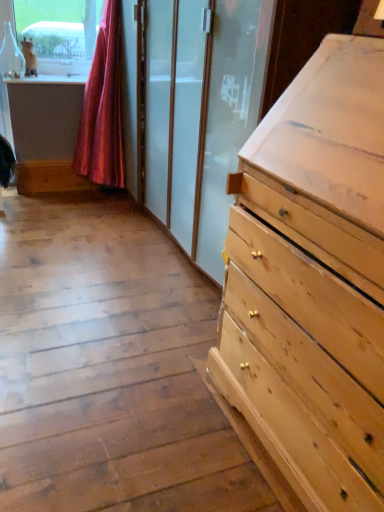
This screenshot has height=512, width=384. Describe the element at coordinates (103, 108) in the screenshot. I see `silky pink curtain at upper left` at that location.

You are a GUI agent. You are given a task and a screenshot of the screen. Output one action in this format:
    pyautogui.click(x=<x>, y=<y>)
    Task: Click on the silky pink curtain at upper left
    This screenshot has height=512, width=384.
    Given the screenshot: What is the action you would take?
    pyautogui.click(x=103, y=108)

The image size is (384, 512). What are the coordinates of `white fur cat at upper left` in the screenshot? It's located at (29, 57).

This screenshot has height=512, width=384. What do you see at coordinates (29, 57) in the screenshot?
I see `white fur cat at upper left` at bounding box center [29, 57].

At what (x,y) coordinates should I click in order to perform the action: click on silky pink curtain at upper left. Please return your answer as a coordinate pair (x, y). Looking at the image, I should click on (103, 108).

Considering the relative positions of silky pink curtain at upper left and white fur cat at upper left in the image provided, is silky pink curtain at upper left to the left of white fur cat at upper left from the viewer's perspective?

In fact, silky pink curtain at upper left is to the right of white fur cat at upper left.

Between silky pink curtain at upper left and white fur cat at upper left, which one is positioned in front?

silky pink curtain at upper left.

Is point (85, 127) positioned behind point (23, 42)?

Yes, point (85, 127) is behind point (23, 42).

From the image's perspective, is silky pink curtain at upper left located beneath white fur cat at upper left?

Indeed, from the image's perspective, silky pink curtain at upper left is shown beneath white fur cat at upper left.

From a real-world perspective, which object stands above the other?

From a 3D spatial view, white fur cat at upper left is above.

Considering the sizes of objects silky pink curtain at upper left and white fur cat at upper left in the image provided, who is wider, silky pink curtain at upper left or white fur cat at upper left?

With larger width is silky pink curtain at upper left.

Who is shorter, silky pink curtain at upper left or white fur cat at upper left?

Standing shorter between the two is white fur cat at upper left.

In terms of size, does silky pink curtain at upper left appear bigger or smaller than white fur cat at upper left?

Considering their sizes, silky pink curtain at upper left takes up more space than white fur cat at upper left.

Can white fur cat at upper left be found inside silky pink curtain at upper left?

Actually, white fur cat at upper left is outside silky pink curtain at upper left.

Is silky pink curtain at upper left positioned far away from white fur cat at upper left?

That's not correct — silky pink curtain at upper left is a little close to white fur cat at upper left.

From the picture: Is silky pink curtain at upper left oriented towards white fur cat at upper left?

No.

How distant is silky pink curtain at upper left from white fur cat at upper left?

silky pink curtain at upper left is 22.53 inches from white fur cat at upper left.

Identify the location of animal located above the silky pink curtain at upper left (from the image's perspective). This screenshot has height=512, width=384. (29, 57).

Is white fur cat at upper left at the left side of silky pink curtain at upper left?

Indeed, white fur cat at upper left is positioned on the left side of silky pink curtain at upper left.

Which object is closer to the camera, white fur cat at upper left or silky pink curtain at upper left?

silky pink curtain at upper left is more forward.

Considering the points (34, 66) and (101, 109), which point is behind, point (34, 66) or point (101, 109)?

The point (34, 66) is farther.

From the image's perspective, which is below, white fur cat at upper left or silky pink curtain at upper left?

silky pink curtain at upper left.

From a real-world perspective, is white fur cat at upper left physically above silky pink curtain at upper left?

Indeed, from a real-world perspective, white fur cat at upper left stands above silky pink curtain at upper left.

Which object is wider, white fur cat at upper left or silky pink curtain at upper left?

silky pink curtain at upper left.

Can you confirm if white fur cat at upper left is taller than silky pink curtain at upper left?

No, white fur cat at upper left is not taller than silky pink curtain at upper left.

In the scene shown: Which of these two, white fur cat at upper left or silky pink curtain at upper left, is bigger?

Bigger between the two is silky pink curtain at upper left.

Consider the image. Would you say white fur cat at upper left contains silky pink curtain at upper left?

No, silky pink curtain at upper left is not inside white fur cat at upper left.

Is white fur cat at upper left next to silky pink curtain at upper left and touching it?

white fur cat at upper left is not next to silky pink curtain at upper left, and they're not touching.

Could you tell me if white fur cat at upper left is facing silky pink curtain at upper left?

No, white fur cat at upper left is not turned towards silky pink curtain at upper left.

The image size is (384, 512). Identify the location of animal that is on the left side of silky pink curtain at upper left. (29, 57).

You are a GUI agent. You are given a task and a screenshot of the screen. Output one action in this format:
    pyautogui.click(x=<x>, y=<y>)
    Task: Click on the animal on the left side of silky pink curtain at upper left
    Image resolution: width=384 pixels, height=512 pixels.
    Given the screenshot: What is the action you would take?
    pyautogui.click(x=29, y=57)

There is a silky pink curtain at upper left. Identify the location of animal above it (from a real-world perspective). (29, 57).